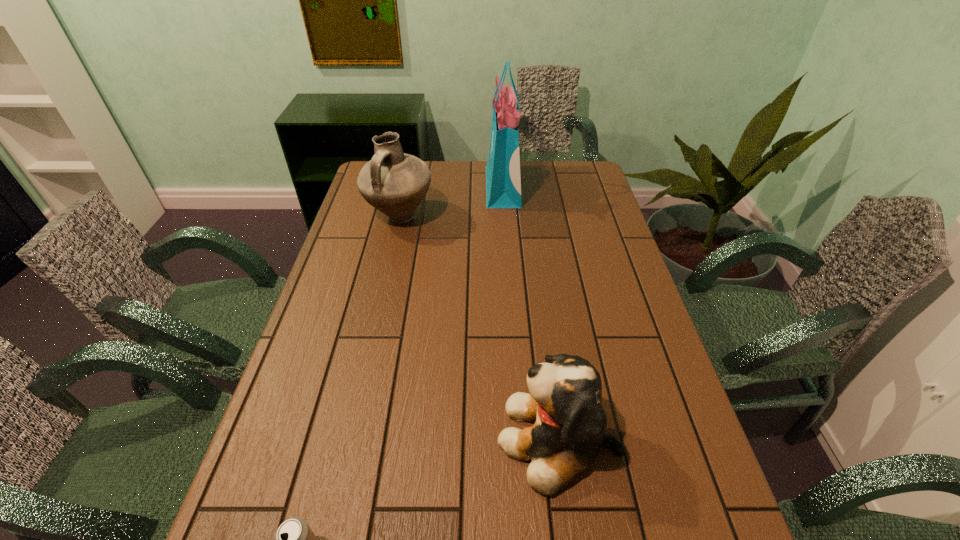
You are a GUI agent. You are given a task and a screenshot of the screen. Output one action in this format:
    pyautogui.click(x=<x>, y=<y>)
    Task: Click on the object that stands as the third closest to the third farthest object
    The image size is (960, 540).
    Given the screenshot: What is the action you would take?
    pyautogui.click(x=503, y=180)